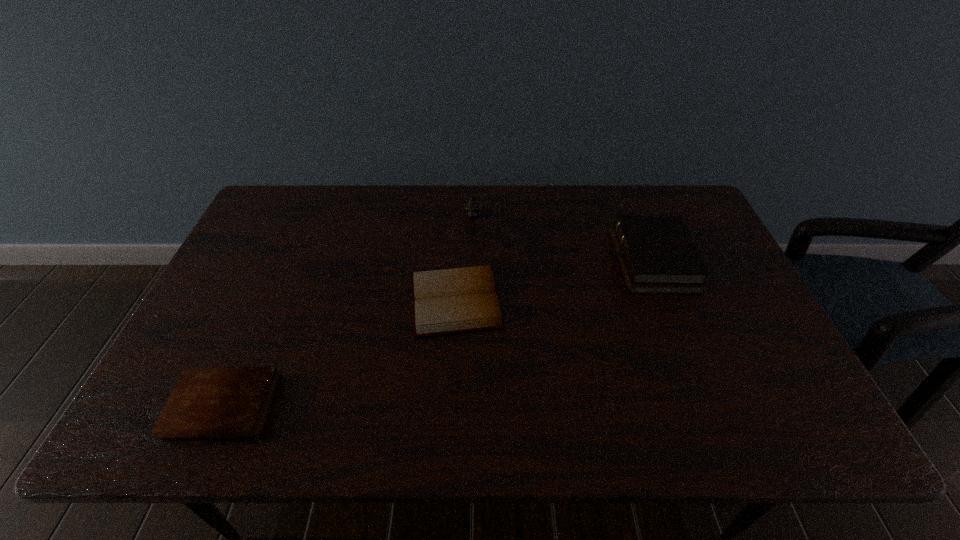
The width and height of the screenshot is (960, 540). Identify the location of free space between the rightmost object and the snail. (563, 239).

You are a GUI agent. You are given a task and a screenshot of the screen. Output one action in this format:
    pyautogui.click(x=<x>, y=<y>)
    Task: Click on the closest object to the nearest Bible
    This screenshot has height=540, width=960.
    Given the screenshot: What is the action you would take?
    pyautogui.click(x=446, y=301)

Locate an element on the screen. object that stands as the closest to the farthest object is located at coordinates (446, 301).

Locate which Bible ranks in proximity to the leftmost object. Please provide its 2D coordinates. Your answer should be formatted as a tuple, i.e. [(x, y)], where the tuple contains the x and y coordinates of a point satisfying the conditions above.

[(446, 301)]

Identify which Bible is the second closest to the nearest Bible. Please provide its 2D coordinates. Your answer should be formatted as a tuple, i.e. [(x, y)], where the tuple contains the x and y coordinates of a point satisfying the conditions above.

[(657, 255)]

Locate an element on the screen. The height and width of the screenshot is (540, 960). free space that satisfies the following two spatial constraints: 1. on the spine side of the tallest Bible; 2. on the spine side of the nearest object is located at coordinates (709, 406).

Locate an element on the screen. The image size is (960, 540). vacant space that satisfies the following two spatial constraints: 1. on the spine side of the rightmost Bible; 2. on the spine side of the leftmost Bible is located at coordinates (709, 406).

The image size is (960, 540). Identify the location of blank area in the image that satisfies the following two spatial constraints: 1. on the spine side of the second tallest object; 2. on the spine side of the nearest Bible. (709, 406).